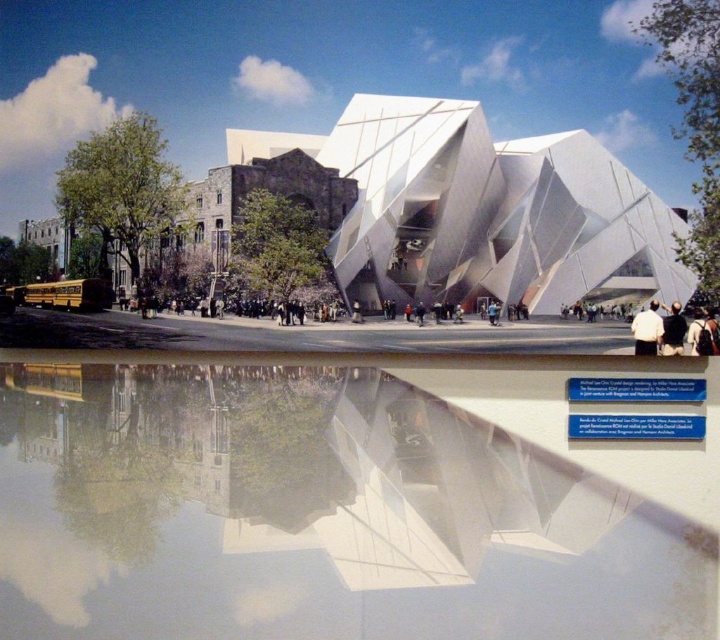
Question: Among these objects, which one is farthest from the camera?

Choices:
 (A) white matte shirt at center
 (B) black hair at lower right

Answer: (A)

Question: Is transparent glass water at center above black hair at lower right?

Choices:
 (A) yes
 (B) no

Answer: (B)

Question: Does white matte shirt at center lie in front of black hair at lower right?

Choices:
 (A) no
 (B) yes

Answer: (A)

Question: Estimate the real-world distances between objects in this image. Which object is closer to the transparent glass water at center?

Choices:
 (A) black hair at lower right
 (B) white matte shirt at center

Answer: (B)

Question: Is transparent glass water at center thinner than white matte shirt at center?

Choices:
 (A) no
 (B) yes

Answer: (A)

Question: Which object appears closest to the camera in this image?

Choices:
 (A) white matte shirt at center
 (B) black hair at lower right
 (C) transparent glass water at center

Answer: (C)